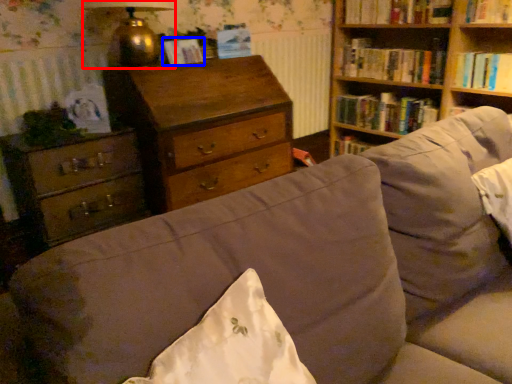
Question: Which of the following is the farthest to the observer, lamp (highlighted by a red box) or paperback book (highlighted by a blue box)?

Choices:
 (A) lamp
 (B) paperback book

Answer: (B)